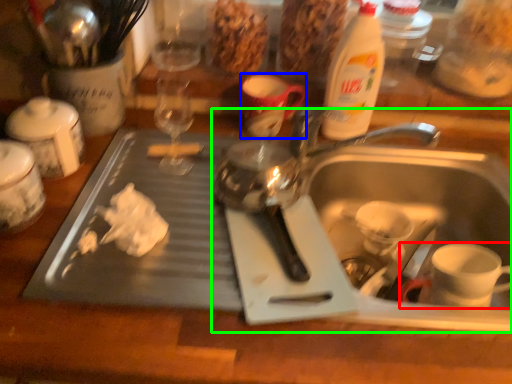
Question: Based on their relative distances, which object is farther from coffee cup (highlighted by a red box)? Choose from mug (highlighted by a blue box) and sink (highlighted by a green box).

Choices:
 (A) mug
 (B) sink

Answer: (A)